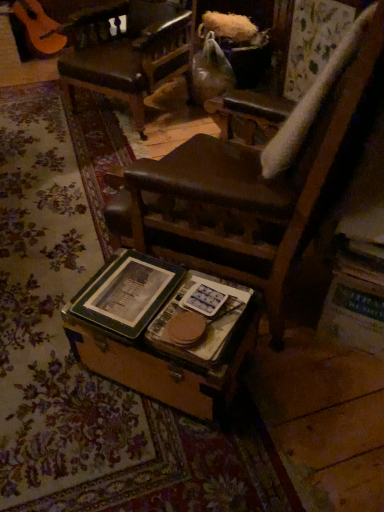
Find the location of a particular element. This screenshot has height=512, width=384. vacant region to the left of wooden trunk at center is located at coordinates (50, 375).